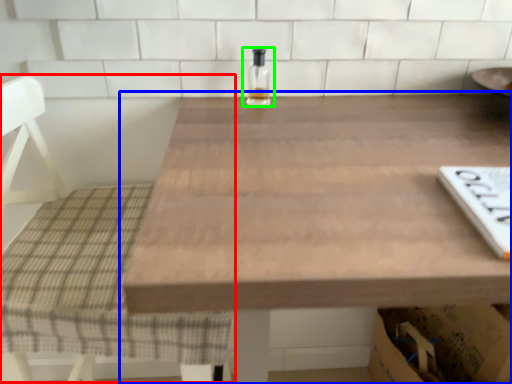
Question: Which is farther away from chair (highlighted by a red box)? table (highlighted by a blue box) or bottle (highlighted by a green box)?

Choices:
 (A) table
 (B) bottle

Answer: (B)